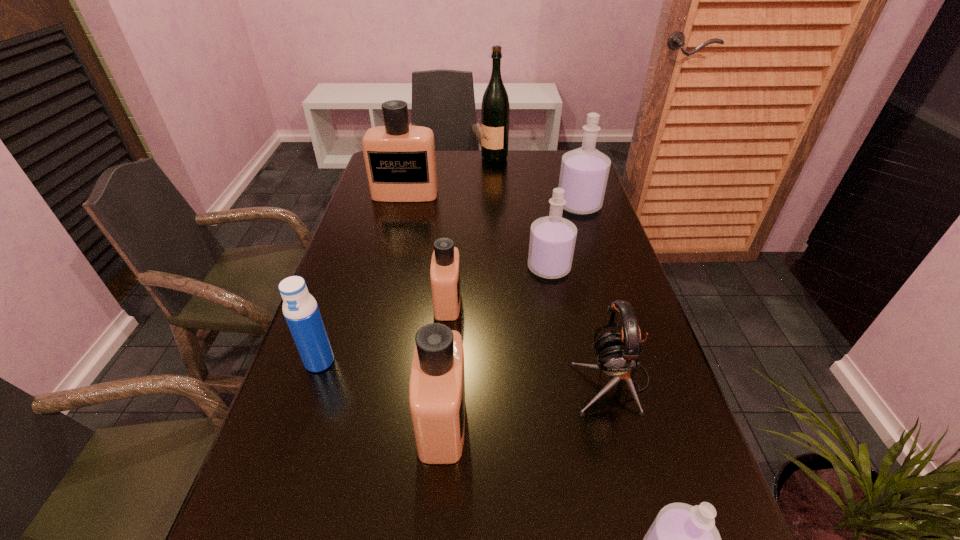
At what (x,y) coordinates should I click in order to perform the action: click on beige perfume identified as the second closest to the fifth nearest object. Please return your answer as a coordinate pair (x, y). Image resolution: width=960 pixels, height=540 pixels. Looking at the image, I should click on (400, 159).

You are a GUI agent. You are given a task and a screenshot of the screen. Output one action in this format:
    pyautogui.click(x=<x>, y=<y>)
    Task: Click on the purple perfume that can be found as the third closest to the green liquor
    
    Given the screenshot: What is the action you would take?
    click(683, 539)

Image resolution: width=960 pixels, height=540 pixels. I want to click on purple perfume that is the closest to the second biggest purple perfume, so click(584, 172).

The image size is (960, 540). Identify the location of vacant space that satisfies the following two spatial constraints: 1. on the back side of the blue water bottle; 2. on the left side of the biggest purple perfume. (372, 205).

The width and height of the screenshot is (960, 540). Identify the location of free space that satisfies the following two spatial constraints: 1. on the front-facing side of the second smallest purple perfume; 2. on the left side of the fifth object from right to left. (500, 268).

What are the coordinates of `vacant space that satisfies the following two spatial constraints: 1. on the front label of the farthest beige perfume; 2. on the left side of the fourth nearest perfume` in the screenshot? It's located at (387, 268).